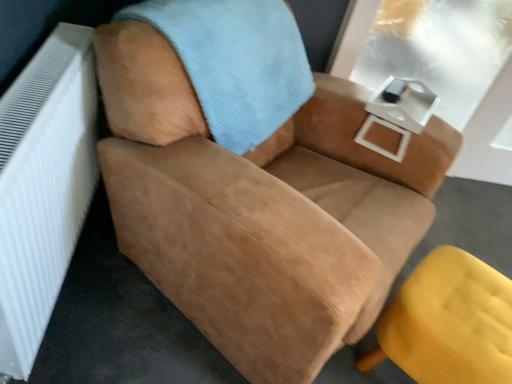
Describe the element at coordinates (398, 112) in the screenshot. This screenshot has width=512, height=384. I see `white glossy table at upper right` at that location.

You are a GUI agent. You are given a task and a screenshot of the screen. Output one action in this format:
    pyautogui.click(x=<x>, y=<y>)
    Task: Click on the white textured radiator at left
    
    Given the screenshot: What is the action you would take?
    pyautogui.click(x=42, y=186)

The image size is (512, 384). What do you see at coordinates (258, 207) in the screenshot?
I see `suede tan chair at center, the second chair from the bottom` at bounding box center [258, 207].

Locate an element on the screen. The width and height of the screenshot is (512, 384). light blue corduroy blanket at upper center is located at coordinates (236, 62).

Describe the element at coordinates (448, 322) in the screenshot. I see `matte yellow ottoman at lower right, which is counted as the 1th chair, starting from the bottom` at that location.

Where is `white glossy table at upper right`? white glossy table at upper right is located at coordinates (398, 112).

Based on the photo, is matte yellow ottoman at lower right, which is the 2th chair from top to bottom, smaller than light blue corduroy blanket at upper center?

Yes.

Who is more distant, matte yellow ottoman at lower right, which is the 2th chair from top to bottom, or light blue corduroy blanket at upper center?

Positioned behind is matte yellow ottoman at lower right, which is the 2th chair from top to bottom.

Measure the distance from matte yellow ottoman at lower right, which is counted as the 1th chair, starting from the bottom, to light blue corduroy blanket at upper center.

matte yellow ottoman at lower right, which is counted as the 1th chair, starting from the bottom, and light blue corduroy blanket at upper center are 31.56 inches apart from each other.

Which object is wider, light blue corduroy blanket at upper center or white textured radiator at left?

light blue corduroy blanket at upper center is wider.

Is light blue corduroy blanket at upper center facing away from white textured radiator at left?

light blue corduroy blanket at upper center is not turned away from white textured radiator at left.

From the image's perspective, which one is positioned higher, light blue corduroy blanket at upper center or white textured radiator at left?

light blue corduroy blanket at upper center is shown above in the image.

Who is more distant, light blue corduroy blanket at upper center or white textured radiator at left?

light blue corduroy blanket at upper center is further from the camera.

Is light blue corduroy blanket at upper center positioned behind suede tan chair at center, the second chair from the bottom?

Yes, it is behind suede tan chair at center, the second chair from the bottom.

Is light blue corduroy blanket at upper center taller than suede tan chair at center, the second chair from the bottom?

Incorrect, the height of light blue corduroy blanket at upper center is not larger of that of suede tan chair at center, the second chair from the bottom.

Is light blue corduroy blanket at upper center facing away from suede tan chair at center, the second chair from the bottom?

Result: Yes.

You are a GUI agent. You are given a task and a screenshot of the screen. Output one action in this format:
    pyautogui.click(x=<x>, y=<y>)
    Task: Click on the 1st chair to the right of the light blue corduroy blanket at upper center, starting your count from the anchor
    This screenshot has height=384, width=512.
    Given the screenshot: What is the action you would take?
    pyautogui.click(x=258, y=207)

Is there a large distance between white glossy table at upper right and matte yellow ottoman at lower right, which is the 2th chair from top to bottom?

Actually, white glossy table at upper right and matte yellow ottoman at lower right, which is the 2th chair from top to bottom, are a little close together.

Which is less distant, (422, 108) or (382, 357)?

Clearly, point (422, 108) is more distant from the camera than point (382, 357).

I want to click on table lying above the matte yellow ottoman at lower right, which is the 2th chair from top to bottom (from the image's perspective), so click(398, 112).

Is point (384, 324) in front of point (34, 148)?

No, (384, 324) is behind (34, 148).

Can we say matte yellow ottoman at lower right, which is counted as the 1th chair, starting from the bottom, lies outside white textured radiator at left?

Yes.

From the image's perspective, is matte yellow ottoman at lower right, which is the 2th chair from top to bottom, under white textured radiator at left?

Yes, from the image's perspective, matte yellow ottoman at lower right, which is the 2th chair from top to bottom, is beneath white textured radiator at left.

Does matte yellow ottoman at lower right, which is counted as the 1th chair, starting from the bottom, have a lesser width compared to white textured radiator at left?

Incorrect, the width of matte yellow ottoman at lower right, which is counted as the 1th chair, starting from the bottom, is not less than that of white textured radiator at left.

From the image's perspective, is suede tan chair at center, the second chair from the bottom, located beneath white textured radiator at left?

No, from the image's perspective, suede tan chair at center, the second chair from the bottom, is not below white textured radiator at left.

Which object is closer to the camera, suede tan chair at center, the second chair from the bottom, or white textured radiator at left?

white textured radiator at left is in front.

Is suede tan chair at center, the second chair from the bottom, wider than white textured radiator at left?

Correct, the width of suede tan chair at center, the second chair from the bottom, exceeds that of white textured radiator at left.

Considering the relative sizes of suede tan chair at center, the 1th chair in the top-to-bottom sequence, and white textured radiator at left in the image provided, is suede tan chair at center, the 1th chair in the top-to-bottom sequence, bigger than white textured radiator at left?

Yes.

Can you confirm if white textured radiator at left is positioned to the right of suede tan chair at center, the second chair from the bottom?

No.

From a real-world perspective, is white textured radiator at left physically above suede tan chair at center, the second chair from the bottom?

No.

Is suede tan chair at center, the 1th chair in the top-to-bottom sequence, completely or partially inside white textured radiator at left?

No, suede tan chair at center, the 1th chair in the top-to-bottom sequence, is not surrounded by white textured radiator at left.

Does point (77, 50) lie behind point (370, 181)?

No, (77, 50) is in front of (370, 181).

The image size is (512, 384). What are the coordinates of `blanket that is on the left side of matte yellow ottoman at lower right, which is the 2th chair from top to bottom` in the screenshot? It's located at (236, 62).

At what (x,y) coordinates should I click in order to perform the action: click on blanket lying above the white textured radiator at left (from the image's perspective). Please return your answer as a coordinate pair (x, y). The width and height of the screenshot is (512, 384). Looking at the image, I should click on (236, 62).

From the image, which object appears to be farther from matte yellow ottoman at lower right, which is the 2th chair from top to bottom, light blue corduroy blanket at upper center or white textured radiator at left?

white textured radiator at left.

When comparing their distances from white textured radiator at left, does white glossy table at upper right or light blue corduroy blanket at upper center seem closer?

light blue corduroy blanket at upper center.

When comparing their distances from white glossy table at upper right, does suede tan chair at center, the 1th chair in the top-to-bottom sequence, or light blue corduroy blanket at upper center seem further?

Among the two, light blue corduroy blanket at upper center is located further to white glossy table at upper right.

Estimate the real-world distances between objects in this image. Which object is closer to suede tan chair at center, the 1th chair in the top-to-bottom sequence, light blue corduroy blanket at upper center or white textured radiator at left?

Among the two, light blue corduroy blanket at upper center is located nearer to suede tan chair at center, the 1th chair in the top-to-bottom sequence.

From the image, which object appears to be nearer to white glossy table at upper right, light blue corduroy blanket at upper center or suede tan chair at center, the 1th chair in the top-to-bottom sequence?

suede tan chair at center, the 1th chair in the top-to-bottom sequence, lies closer to white glossy table at upper right than the other object.

Based on their spatial positions, is suede tan chair at center, the second chair from the bottom, or white glossy table at upper right further from white textured radiator at left?

white glossy table at upper right.

From the image, which object appears to be nearer to white glossy table at upper right, light blue corduroy blanket at upper center or white textured radiator at left?

The object closer to white glossy table at upper right is light blue corduroy blanket at upper center.

Based on their spatial positions, is suede tan chair at center, the second chair from the bottom, or light blue corduroy blanket at upper center further from matte yellow ottoman at lower right, which is counted as the 1th chair, starting from the bottom?

light blue corduroy blanket at upper center is positioned further to the anchor matte yellow ottoman at lower right, which is counted as the 1th chair, starting from the bottom.

Where is `blanket between white textured radiator at left and white glossy table at upper right`? The width and height of the screenshot is (512, 384). blanket between white textured radiator at left and white glossy table at upper right is located at coordinates (236, 62).

Find the location of a particular element. blanket between white textured radiator at left and suede tan chair at center, the second chair from the bottom, from left to right is located at coordinates (236, 62).

Where is `chair between white glossy table at upper right and matte yellow ottoman at lower right, which is the 2th chair from top to bottom, vertically`? This screenshot has height=384, width=512. chair between white glossy table at upper right and matte yellow ottoman at lower right, which is the 2th chair from top to bottom, vertically is located at coordinates (258, 207).

The height and width of the screenshot is (384, 512). Identify the location of table that lies between light blue corduroy blanket at upper center and matte yellow ottoman at lower right, which is the 2th chair from top to bottom, from top to bottom. (398, 112).